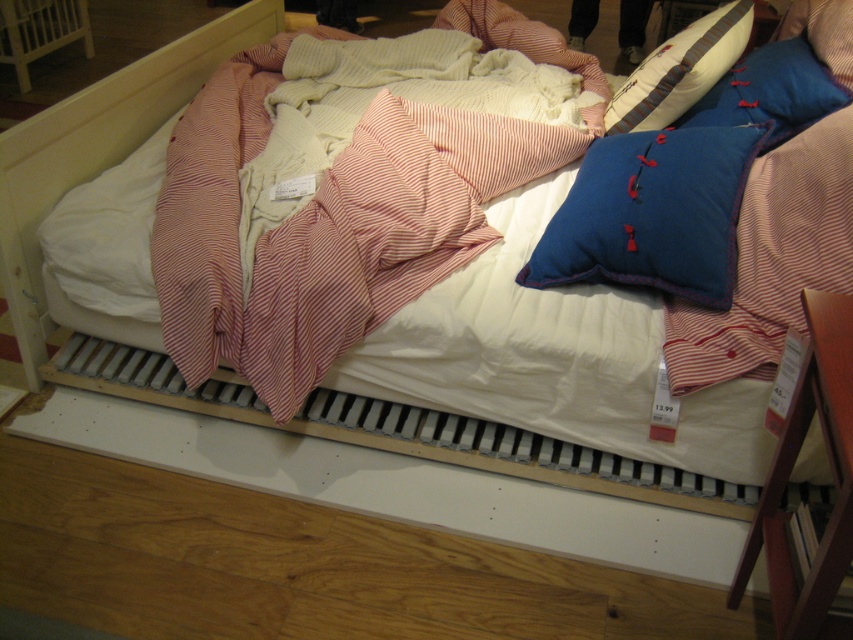
Question: Is pink striped fabric at upper left below blue felt pillow at upper right?

Choices:
 (A) yes
 (B) no

Answer: (B)

Question: Which of these objects is positioned farthest from the blue cotton pillow at upper right?

Choices:
 (A) blue fabric pillow at upper right
 (B) pink striped fabric at upper left

Answer: (B)

Question: Which of the following is the farthest from the observer?

Choices:
 (A) (254, 259)
 (B) (677, 102)
 (C) (782, 308)

Answer: (B)

Question: Is pink striped fabric at upper left positioned at the back of blue cotton pillow at upper right?

Choices:
 (A) yes
 (B) no

Answer: (A)

Question: Which object is the farthest from the blue fabric pillow at upper right?

Choices:
 (A) blue felt pillow at upper right
 (B) velvet-like beige pillow at upper right

Answer: (A)

Question: Can you confirm if pink striped fabric at upper left is bigger than blue cotton pillow at upper right?

Choices:
 (A) no
 (B) yes

Answer: (B)